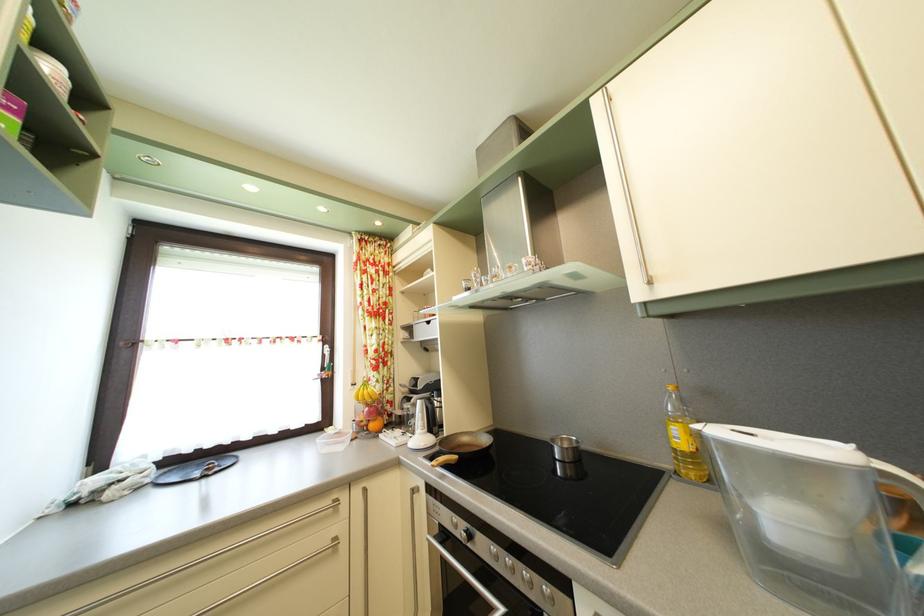
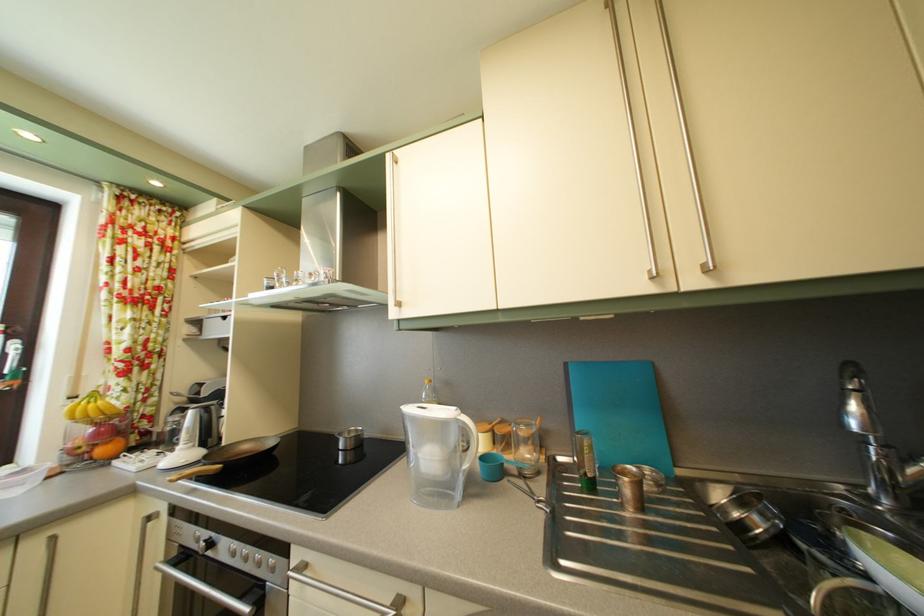
Question: The camera is either moving clockwise (left) or counter-clockwise (right) around the object. The first image is from the beginning of the video and the second image is from the end. Is the camera moving left or right when shooting the video?

Choices:
 (A) Left
 (B) Right

Answer: (A)